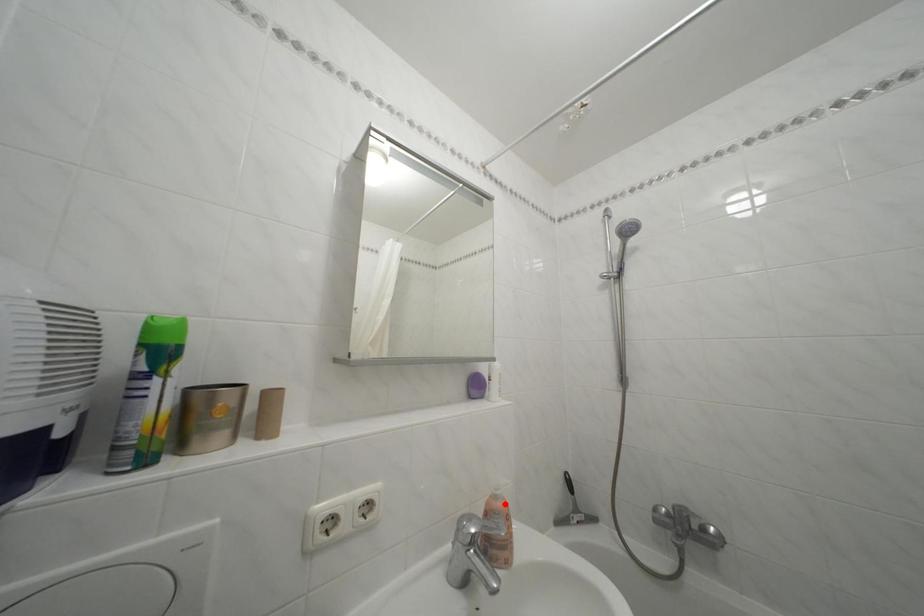
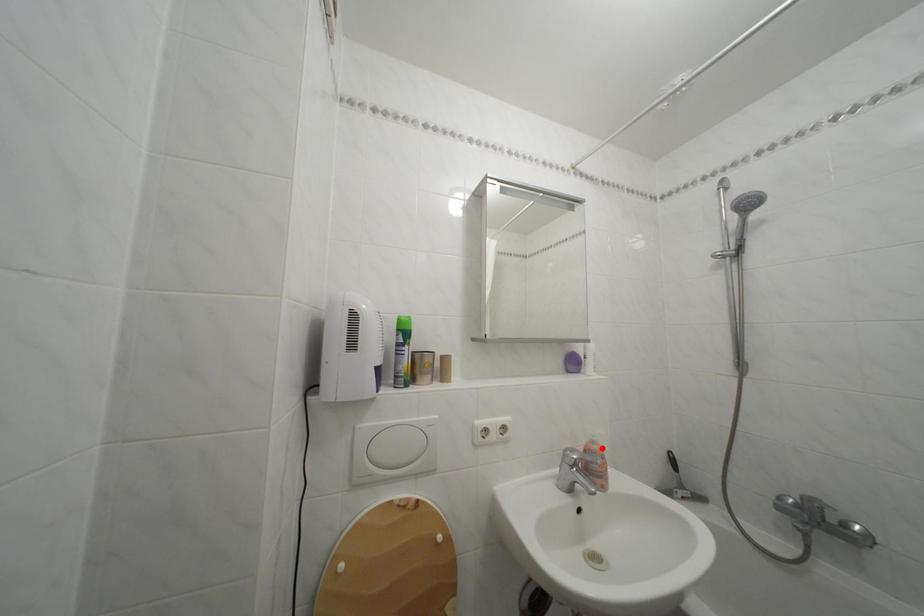
I am providing you with two images of the same scene from different viewpoints. A red point is marked on the first image and another point is marked on the second image. Do the highlighted points in image1 and image2 indicate the same real-world spot?

Yes